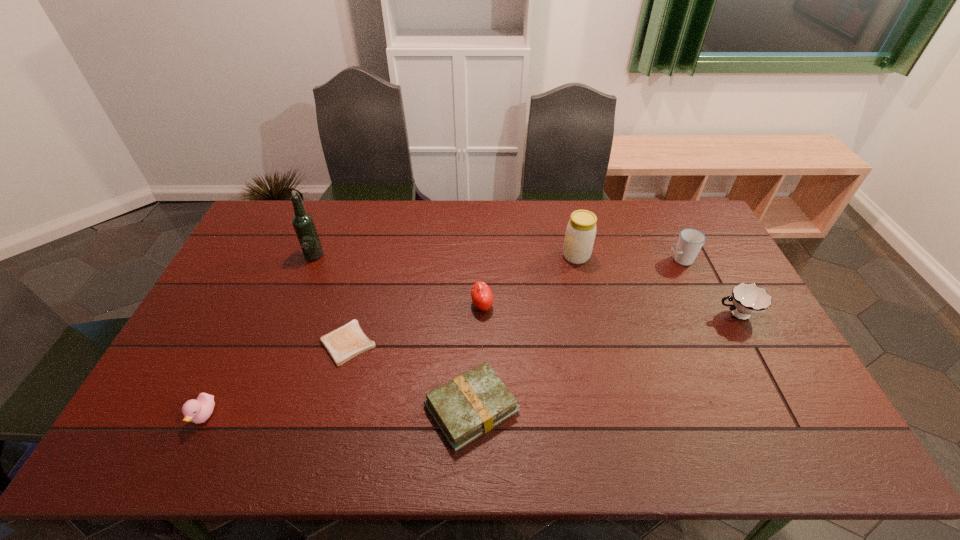
In the image, there is a desktop. Where is `vacant space at the right edge`? vacant space at the right edge is located at coordinates (757, 408).

Locate an element on the screen. vacant space at the far left corner of the desktop is located at coordinates (282, 204).

Locate an element on the screen. The width and height of the screenshot is (960, 540). free space at the far right corner of the desktop is located at coordinates (675, 206).

You are a GUI agent. You are given a task and a screenshot of the screen. Output one action in this format:
    pyautogui.click(x=<x>, y=<y>)
    Task: Click on the unoccupied area between the farther cup and the jar
    The image size is (960, 540).
    Given the screenshot: What is the action you would take?
    pyautogui.click(x=629, y=258)

Where is `free space between the shortest object and the nearer cup`? free space between the shortest object and the nearer cup is located at coordinates (542, 329).

Where is `vacant space that is in between the taller cup and the book`? vacant space that is in between the taller cup and the book is located at coordinates (576, 334).

Find the location of `empty space between the second tallest object and the taller cup`. empty space between the second tallest object and the taller cup is located at coordinates (629, 258).

Identify the location of free area in between the sixth object from left to right and the duckling. (391, 335).

Image resolution: width=960 pixels, height=540 pixels. I want to click on free space between the seventh shortest object and the apple, so click(529, 281).

This screenshot has height=540, width=960. Find the location of `vacant space that is in between the seventh shortest object and the nearer cup`. vacant space that is in between the seventh shortest object and the nearer cup is located at coordinates (657, 285).